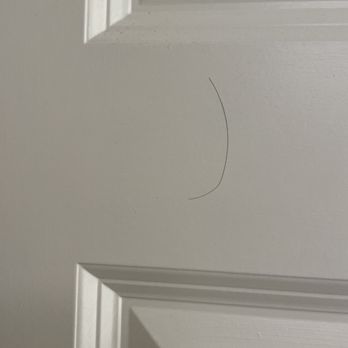
Where is `white paint`? The image size is (348, 348). white paint is located at coordinates (290, 165).